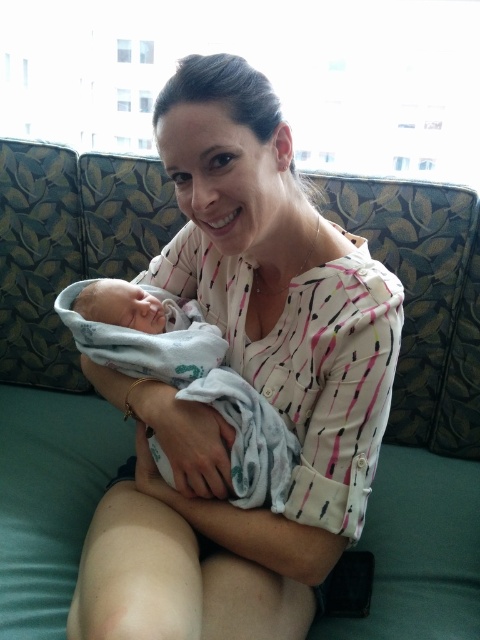
You are a person standing in the room. You need to pick up the white cotton shirt at center. Can you reach it without moving your feet?

The white cotton shirt at center is 24.19 inches away from the viewer. Since this distance is within typical reaching range, you can likely reach it without moving your feet.

Consider the image. You are a photographer setting up for a family photo. You have to ensure that the white cotton shirt at center and the white soft swaddled newborn at center are both visible in the frame. Given their height difference, which object should you adjust the camera angle to focus on first to ensure both are in focus?

The white cotton shirt at center is much taller than the white soft swaddled newborn at center. To ensure both are in focus, adjust the camera angle to focus on the taller object first, which is the white cotton shirt at center, then ensure the newborn is also in the frame.

You are a photographer setting up for a family portrait. You need to ensure that the white cotton shirt at center and the white soft swaddled newborn at center are both visible in the frame. Since the window is bright, you might need to adjust the camera settings. Which object should you position closer to the window to ensure proper exposure?

The white cotton shirt at center should be positioned closer to the window because it is to the right of the white soft swaddled newborn at center, and moving it towards the light source will help balance the exposure between both subjects.